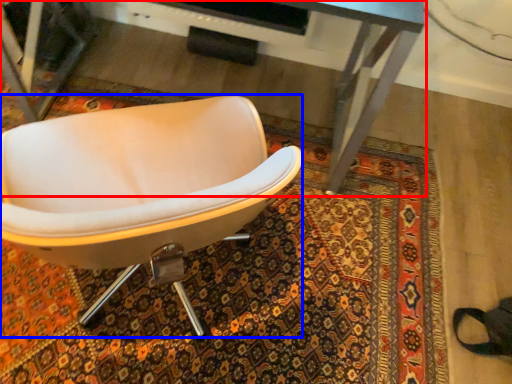
Question: Which point is closer to the camera, desk (highlighted by a red box) or chair (highlighted by a blue box)?

Choices:
 (A) desk
 (B) chair

Answer: (B)